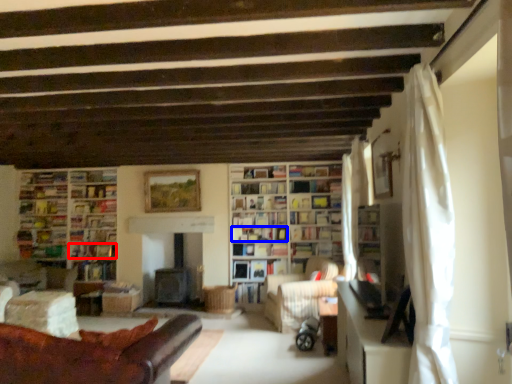
Question: Which object appears farthest to the camera in this image, book (highlighted by a red box) or book (highlighted by a blue box)?

Choices:
 (A) book
 (B) book

Answer: (A)